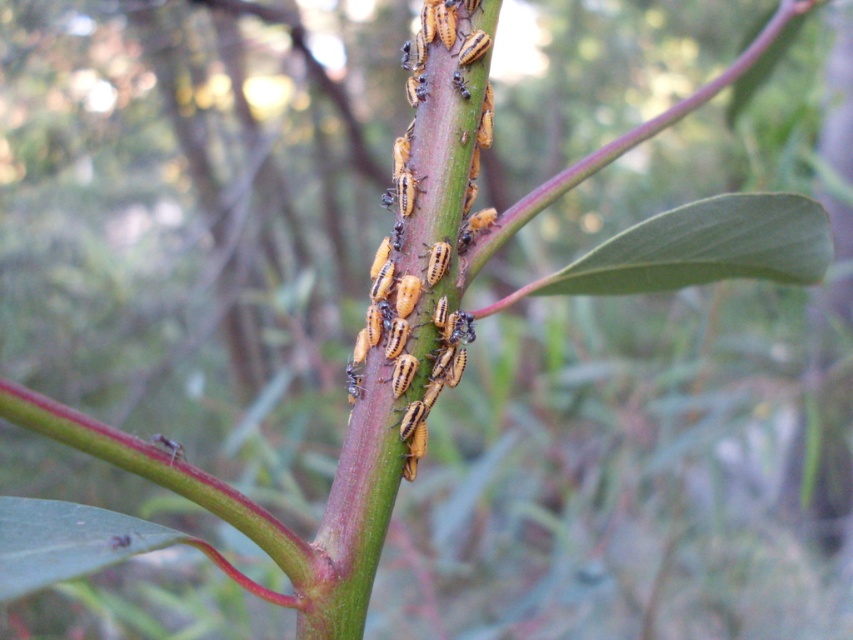
Does yellow matte insects at center have a lesser width compared to green smooth leaf at center?

Yes, yellow matte insects at center is thinner than green smooth leaf at center.

Does yellow matte insects at center have a larger size compared to green smooth leaf at center?

Actually, yellow matte insects at center might be smaller than green smooth leaf at center.

Is point (480, 99) farther from camera compared to point (822, 216)?

No, it is in front of (822, 216).

At what (x,y) coordinates should I click in order to perform the action: click on yellow matte insects at center. Please return your answer as a coordinate pair (x, y). The width and height of the screenshot is (853, 640). Looking at the image, I should click on (439, 166).